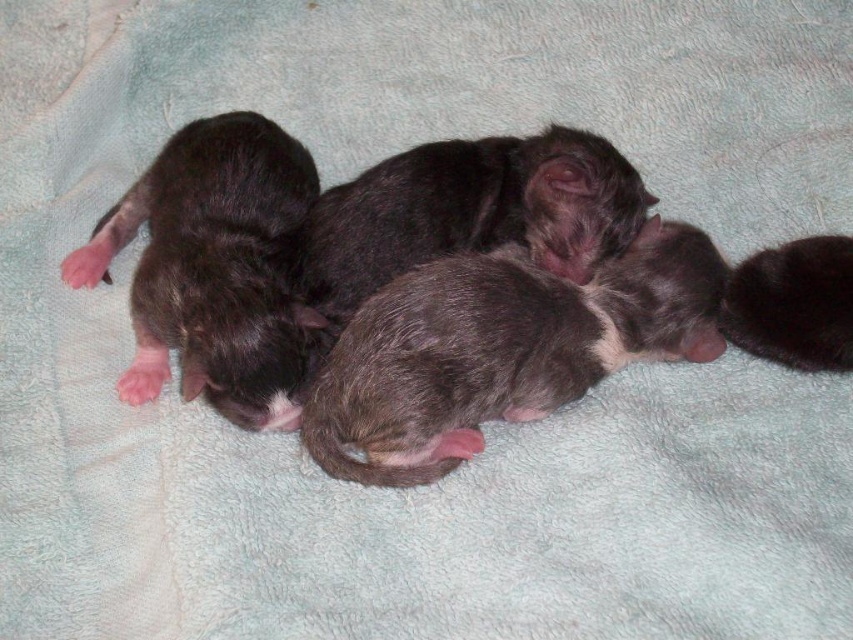
Question: Which object is closer to the camera taking this photo?

Choices:
 (A) fuzzy black puppies at center
 (B) dark gray fur kitten at right

Answer: (B)

Question: Based on their relative distances, which object is nearer to the dark gray fur kitten at right?

Choices:
 (A) fuzzy black puppies at center
 (B) dark gray fur at left

Answer: (A)

Question: Which object is closer to the camera taking this photo?

Choices:
 (A) dark gray fur kitten at right
 (B) fuzzy black puppies at center
 (C) dark gray fur at left

Answer: (C)

Question: Does gray fur kitten at center have a lesser width compared to dark gray fur at left?

Choices:
 (A) no
 (B) yes

Answer: (A)

Question: Can you confirm if dark gray fur at left is positioned to the left of dark gray fur kitten at right?

Choices:
 (A) yes
 (B) no

Answer: (A)

Question: Can you confirm if gray fur kitten at center is wider than dark gray fur at left?

Choices:
 (A) no
 (B) yes

Answer: (B)